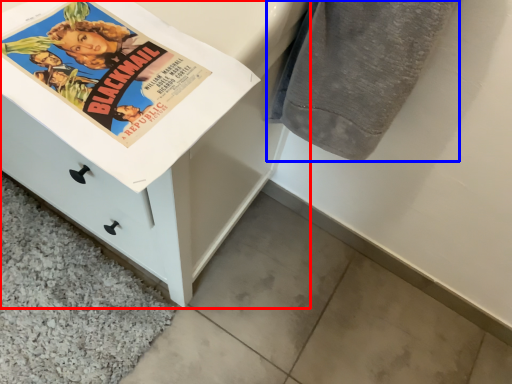
Question: Which point is closer to the camera, chest of drawers (highlighted by a red box) or bath towel (highlighted by a blue box)?

Choices:
 (A) chest of drawers
 (B) bath towel

Answer: (A)